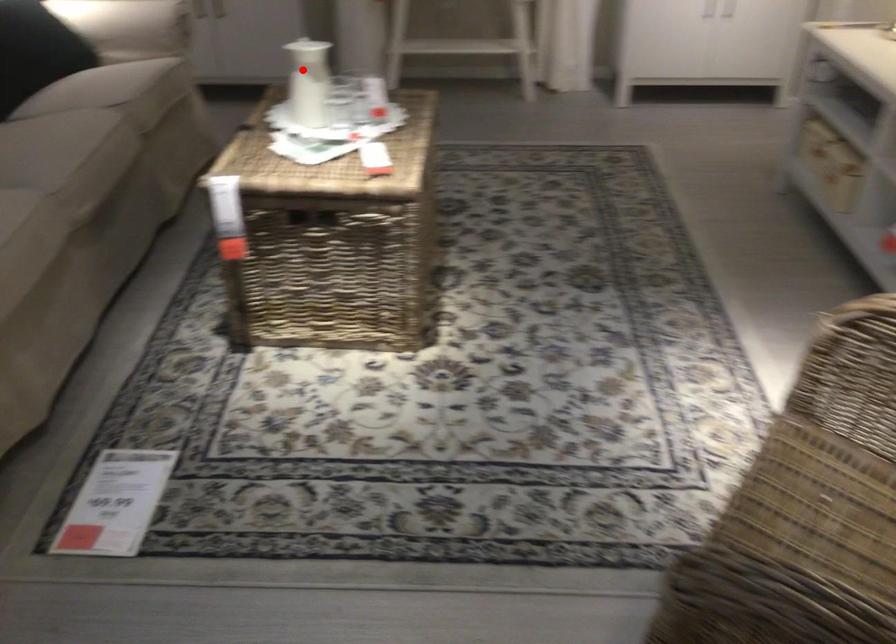
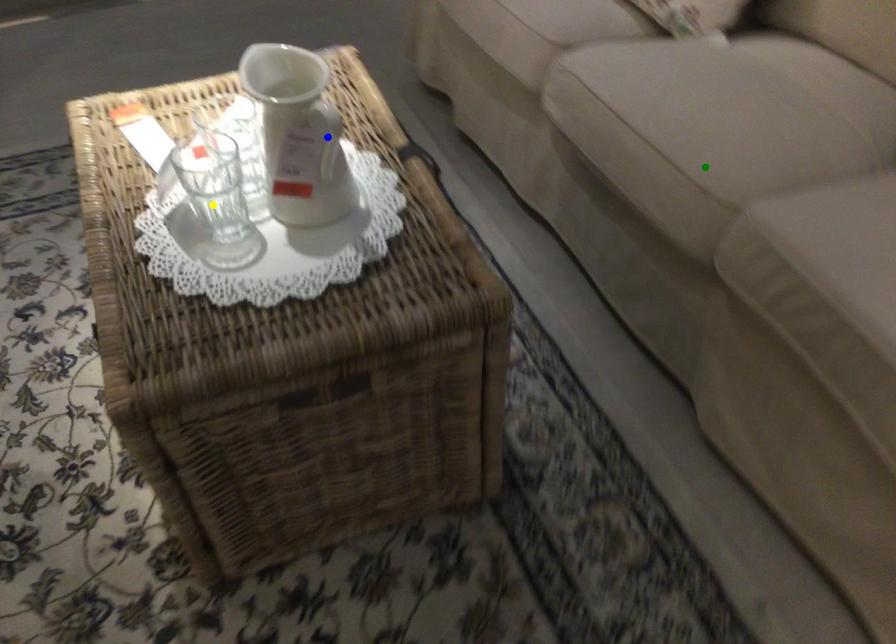
Question: I am providing you with two images of the same scene from different viewpoints. A red point is marked on the first image. You are given multiple points on the second image. Which mark in image 2 goes with the point in image 1?

Choices:
 (A) green point
 (B) yellow point
 (C) blue point

Answer: (C)